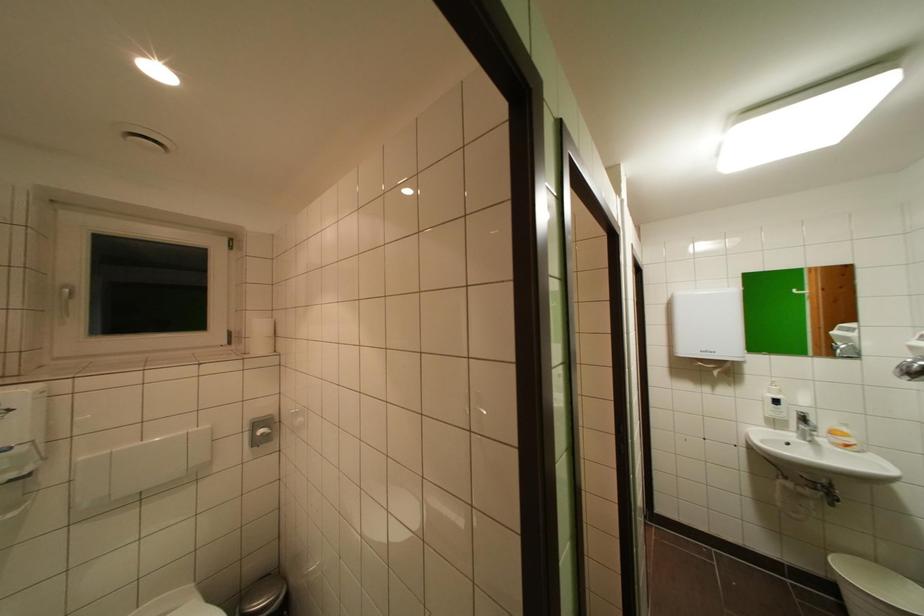
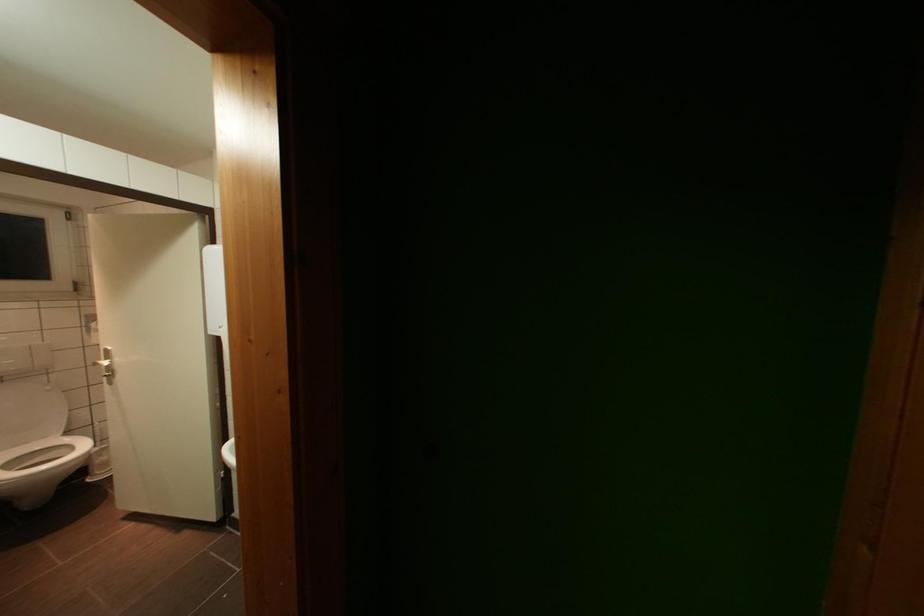
Question: What movement of the cameraman would produce the second image?

Choices:
 (A) Left
 (B) Right
 (C) Forward
 (D) Backward

Answer: (B)